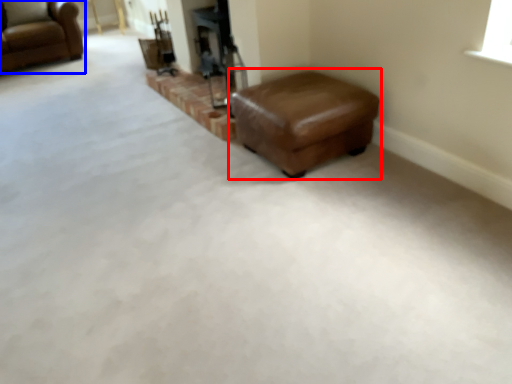
Question: Which of the following is the closest to the observer, stool (highlighted by a red box) or chair (highlighted by a blue box)?

Choices:
 (A) stool
 (B) chair

Answer: (A)